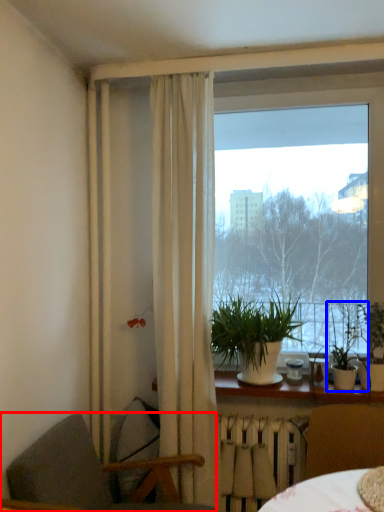
Question: Among these objects, which one is farthest to the camera, chair (highlighted by a red box) or houseplant (highlighted by a blue box)?

Choices:
 (A) chair
 (B) houseplant

Answer: (B)